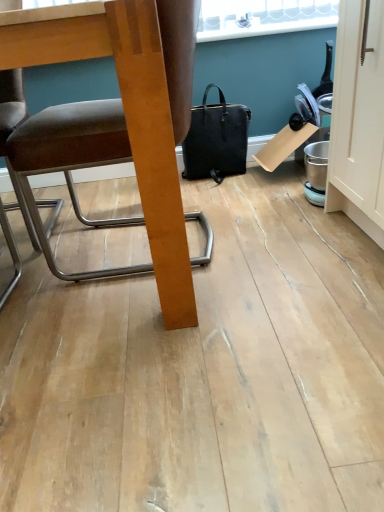
What do you see at coordinates (216, 140) in the screenshot?
I see `black leather handbag at center` at bounding box center [216, 140].

What is the approximate width of black leather handbag at center?

It is 6.87 inches.

Where is `black leather handbag at center`? The image size is (384, 512). black leather handbag at center is located at coordinates (216, 140).

Where is `brown leather chair at left`? brown leather chair at left is located at coordinates (113, 123).

This screenshot has width=384, height=512. What do you see at coordinates (113, 123) in the screenshot? I see `brown leather chair at left` at bounding box center [113, 123].

In order to face brown leather chair at left, should I rotate leftwards or rightwards?

To align with it, rotate left about 19.159°.

Locate an element on the screen. black leather handbag at center is located at coordinates (216, 140).

Does black leather handbag at center appear on the right side of brown leather chair at left?

Indeed, black leather handbag at center is positioned on the right side of brown leather chair at left.

Which is behind, black leather handbag at center or brown leather chair at left?

black leather handbag at center is behind.

Does point (208, 163) appear closer or farther from the camera than point (89, 105)?

Point (208, 163) is farther from the camera than point (89, 105).

From the image's perspective, would you say black leather handbag at center is positioned over brown leather chair at left?

Correct, black leather handbag at center appears higher than brown leather chair at left in the image.

From a real-world perspective, who is located higher, black leather handbag at center or brown leather chair at left?

In real-world perspective, brown leather chair at left is above.

Is black leather handbag at center wider than brown leather chair at left?

In fact, black leather handbag at center might be narrower than brown leather chair at left.

Who is shorter, black leather handbag at center or brown leather chair at left?

With less height is black leather handbag at center.

Which of these two, black leather handbag at center or brown leather chair at left, is smaller?

With smaller size is black leather handbag at center.

Is brown leather chair at left inside black leather handbag at center?

That's incorrect, brown leather chair at left is not inside black leather handbag at center.

Is black leather handbag at center with brown leather chair at left?

No, black leather handbag at center is not next to brown leather chair at left.

Is black leather handbag at center aimed at brown leather chair at left?

No, black leather handbag at center is not oriented towards brown leather chair at left.

Measure the distance between black leather handbag at center and brown leather chair at left.

black leather handbag at center is 33.33 inches from brown leather chair at left.

At what (x,y) coordinates should I click in order to perform the action: click on handbag below the brown leather chair at left (from a real-world perspective). Please return your answer as a coordinate pair (x, y). This screenshot has width=384, height=512. Looking at the image, I should click on (216, 140).

Which object is positioned more to the right, brown leather chair at left or black leather handbag at center?

Positioned to the right is black leather handbag at center.

Which object is further away from the camera taking this photo, brown leather chair at left or black leather handbag at center?

Positioned behind is black leather handbag at center.

Considering the positions of point (110, 35) and point (202, 111), is point (110, 35) closer or farther from the camera than point (202, 111)?

Point (110, 35) is closer to the camera than point (202, 111).

From the image's perspective, which one is positioned higher, brown leather chair at left or black leather handbag at center?

black leather handbag at center appears higher in the image.

From a real-world perspective, who is located higher, brown leather chair at left or black leather handbag at center?

brown leather chair at left is physically above.

Is brown leather chair at left thinner than black leather handbag at center?

No.

Does brown leather chair at left have a greater height compared to black leather handbag at center?

Correct, brown leather chair at left is much taller as black leather handbag at center.

Can you confirm if brown leather chair at left is bigger than black leather handbag at center?

Correct, brown leather chair at left is larger in size than black leather handbag at center.

Can black leather handbag at center be found inside brown leather chair at left?

That's incorrect, black leather handbag at center is not inside brown leather chair at left.

Is brown leather chair at left far away from black leather handbag at center?

No.

Is brown leather chair at left facing towards black leather handbag at center?

No.

How distant is brown leather chair at left from black leather handbag at center?

The distance of brown leather chair at left from black leather handbag at center is 33.33 inches.

Identify the location of handbag lying behind the brown leather chair at left. This screenshot has width=384, height=512. (216, 140).

At what (x,y) coordinates should I click in order to perform the action: click on chair that is above the black leather handbag at center (from a real-world perspective). Please return your answer as a coordinate pair (x, y). Looking at the image, I should click on (113, 123).

I want to click on handbag located underneath the brown leather chair at left (from a real-world perspective), so click(x=216, y=140).